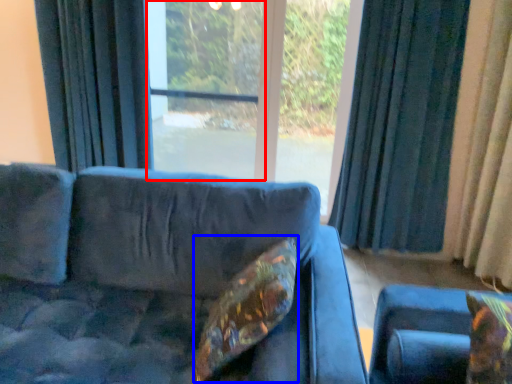
Question: Which object appears farthest to the camera in this image, screen door (highlighted by a red box) or pillow (highlighted by a blue box)?

Choices:
 (A) screen door
 (B) pillow

Answer: (A)